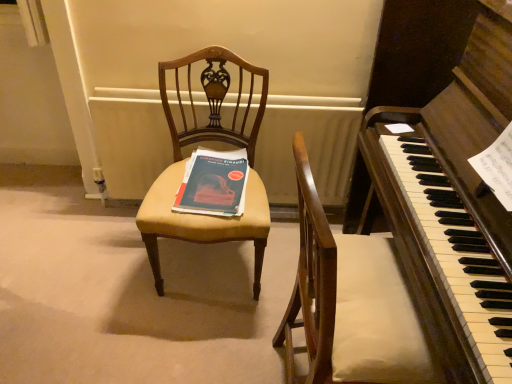
Locate an element on the screen. This screenshot has width=512, height=384. vacant space in front of white painted radiator at center is located at coordinates (152, 324).